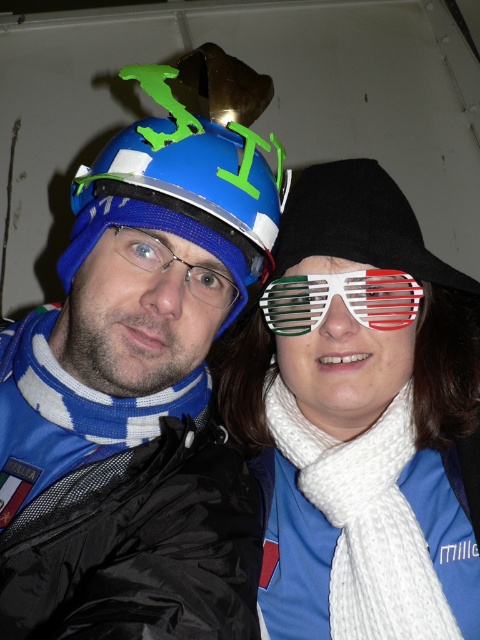
Is white knitted scarf at center bigger than white plastic goggles at center?

Yes, white knitted scarf at center is bigger than white plastic goggles at center.

Between white knitted scarf at center and white plastic goggles at center, which one has less height?

white plastic goggles at center is shorter.

Does point (443, 524) lie behind point (345, 285)?

Yes, it is behind point (345, 285).

Identify the location of white knitted scarf at center. This screenshot has height=640, width=480. (361, 419).

Based on the photo, between white knitted scarf at center and blue matte helmet at left, which one has more height?

white knitted scarf at center is taller.

Measure the distance between point (321, 163) and camera.

34.25 inches

Is point (300, 621) positioned before point (86, 200)?

That is False.

I want to click on white knitted scarf at center, so click(x=361, y=419).

Is blue matte helmet at left bigger than white knitted scarf at right?

Yes.

Is blue matte helmet at left positioned at the back of white knitted scarf at right?

No.

Does point (155, 170) lie in front of point (400, 557)?

Yes, it is.

This screenshot has height=640, width=480. I want to click on blue matte helmet at left, so click(x=189, y=172).